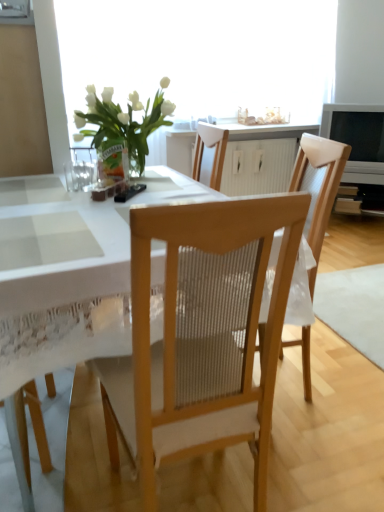
Question: In the image, is translucent glass window screen at upper center on the left side or the right side of wooden chair at center, the 2th chair when ordered from back to front?

Choices:
 (A) right
 (B) left

Answer: (A)

Question: Considering the positions of translucent glass window screen at upper center and wooden chair at center, the 1th chair viewed from the front, in the image, is translucent glass window screen at upper center bigger or smaller than wooden chair at center, the 1th chair viewed from the front,?

Choices:
 (A) small
 (B) big

Answer: (B)

Question: Estimate the real-world distances between objects in this image. Which object is farther from the white lace tablecloth at center?

Choices:
 (A) wooden chair at center, the 2th chair when ordered from back to front
 (B) clear glass vase at center
 (C) wooden chair at center, which appears as the first chair when viewed from the back
 (D) translucent glass window screen at upper center
 (E) white wood cabinet at center

Answer: (E)

Question: Which object is positioned closest to the wooden chair at center, which appears as the first chair when viewed from the back?

Choices:
 (A) translucent glass window screen at upper center
 (B) wooden chair at center, the 2th chair when ordered from back to front
 (C) clear glass vase at center
 (D) white lace tablecloth at center
 (E) white wood cabinet at center

Answer: (B)